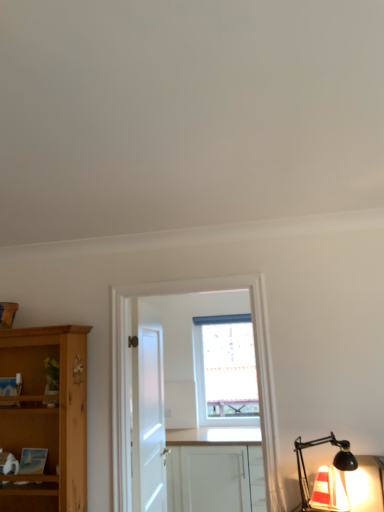
Where is `empty space that is ontop of transparent glass window at center`? The height and width of the screenshot is (512, 384). empty space that is ontop of transparent glass window at center is located at coordinates (226, 313).